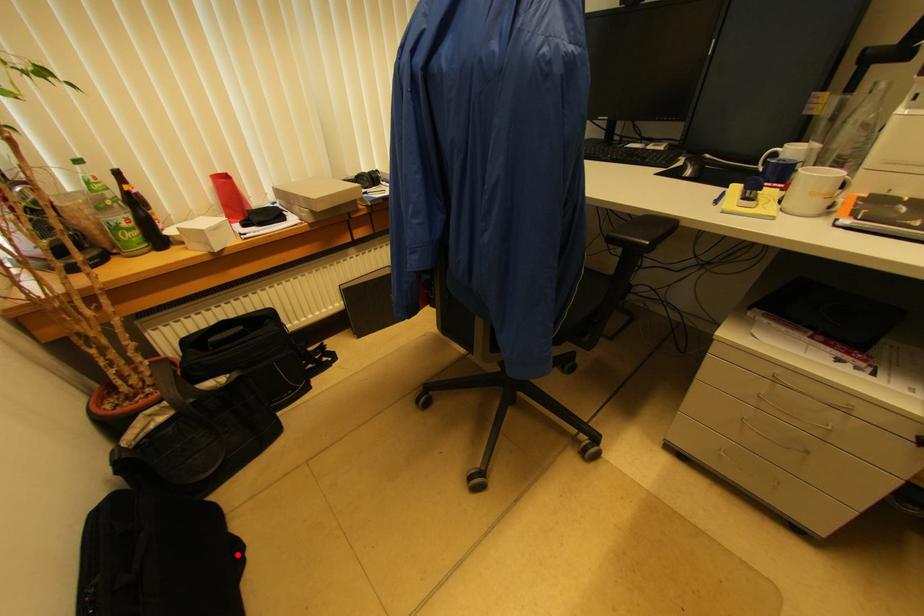
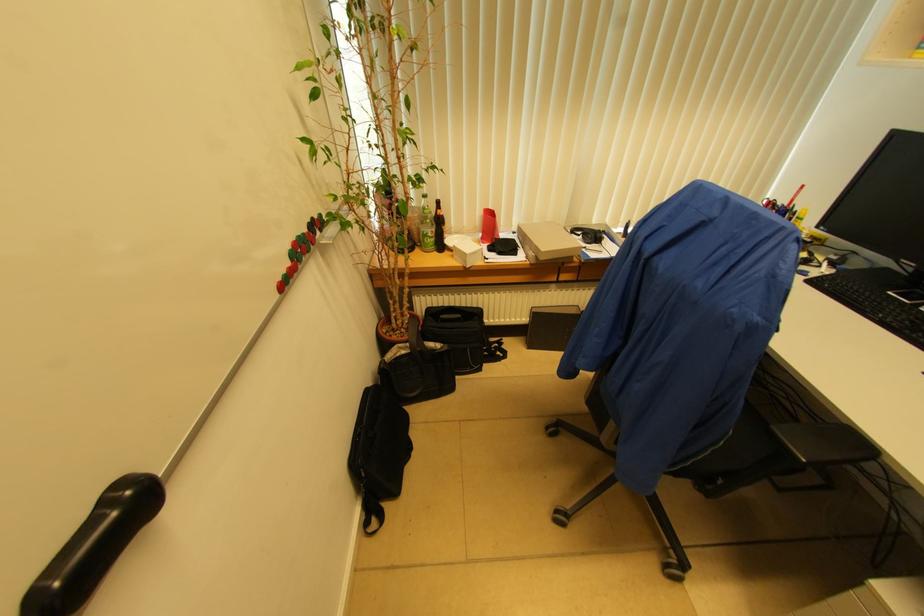
Question: I am providing you with two images of the same scene from different viewpoints. A red point is shown in image1. For the corresponding object point in image2, is it positioned nearer or farther from the camera?

Choices:
 (A) Nearer
 (B) Farther

Answer: (A)